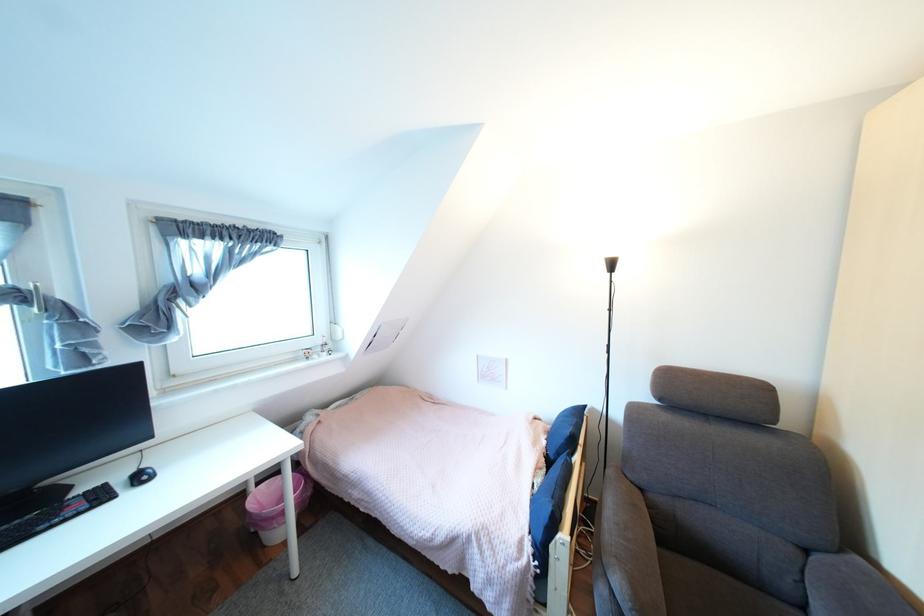
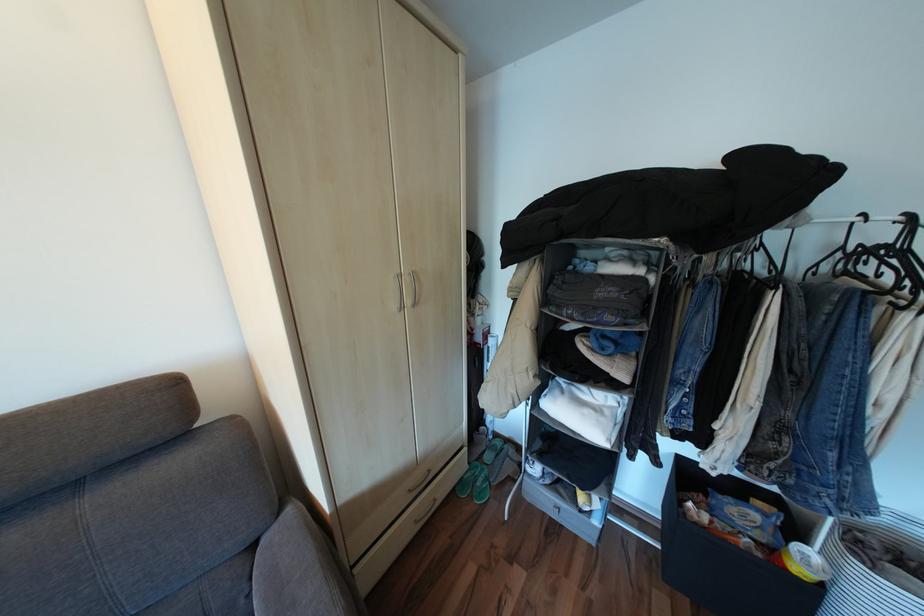
Where in the second image is the point corresponding to pixel 817 551 from the first image?

(263, 545)